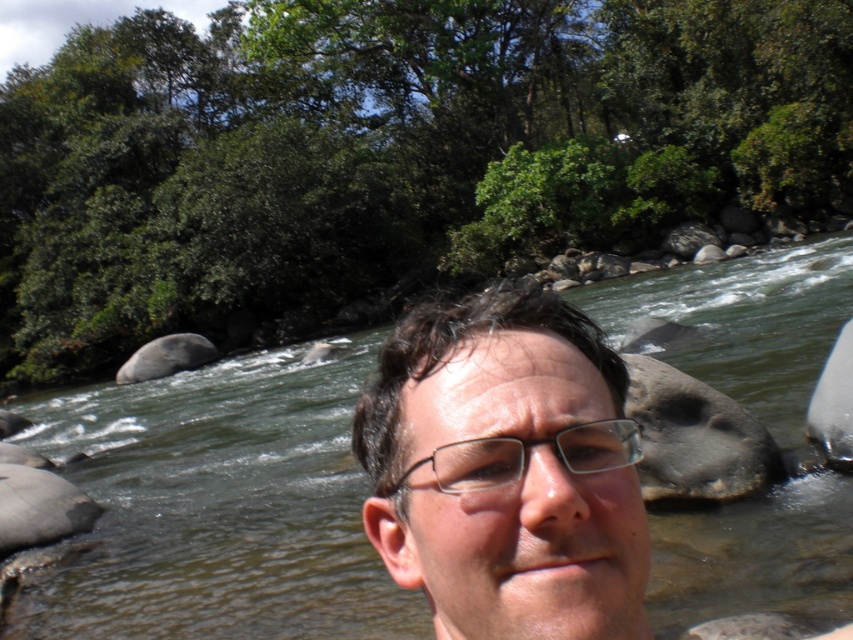
You are standing at the point closer to the camera in the image. Which point are you at, point (73, 410) or point (450, 480)?

You are at point (73, 410) because it is closer to the viewer compared to point (450, 480).

In the scene shown: You are a photographer standing at the location of the person in the image. You want to capture a photo where both the green smooth water at center and the matte skin face at center are clearly visible. Given that your camera has a depth of field that can focus on objects within a 10 meter range, will you be able to achieve this?

The green smooth water at center and matte skin face at center are 14.52 meters apart from each other. Since the camera can only focus on objects within a 10 meter range, the distance between them exceeds this limit. Therefore, you won not be able to capture both clearly in focus in the same photo.

You are a photographer standing in front of the scene. You want to capture a photo where the matte skin face at center is positioned above the green smooth water at center. Is this possible based on the current arrangement?

Yes, because the green smooth water at center is already positioned below the matte skin face at center, so the photo can be taken as desired.